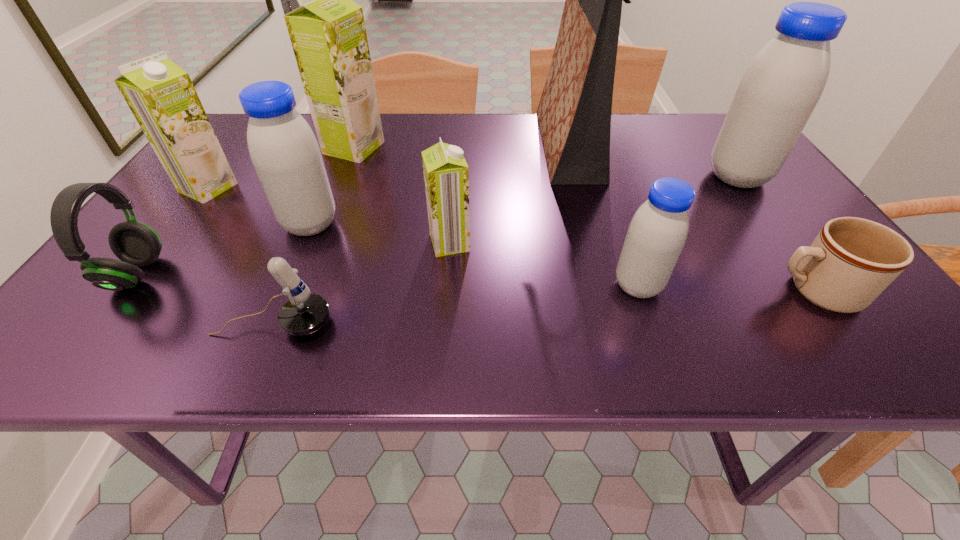
Identify the location of free space that satisfies the following two spatial constraints: 1. on the side of the mug with the handle; 2. on the front side of the leftmost soya milk. (741, 187).

I want to click on free region that satisfies the following two spatial constraints: 1. on the back side of the farthest green soya milk; 2. on the right side of the leftmost blue soya milk, so click(x=343, y=147).

Find the location of a particular element. The width and height of the screenshot is (960, 540). vacant space that satisfies the following two spatial constraints: 1. on the front-facing side of the shopping bag; 2. on the back side of the smallest blue soya milk is located at coordinates 603,286.

This screenshot has width=960, height=540. What are the coordinates of `free location that satisfies the following two spatial constraints: 1. on the ear cups of the headset; 2. on the right side of the microphone` in the screenshot? It's located at (99, 323).